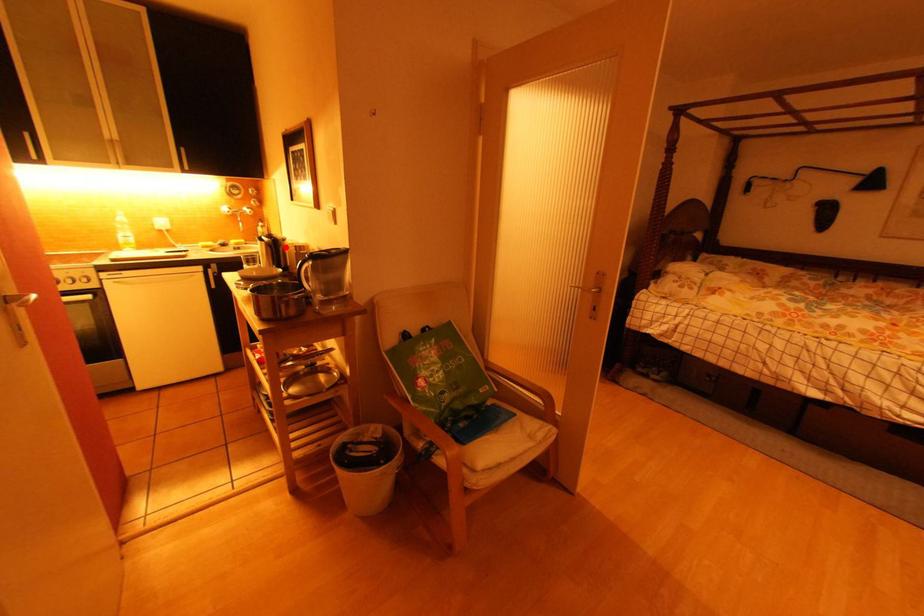
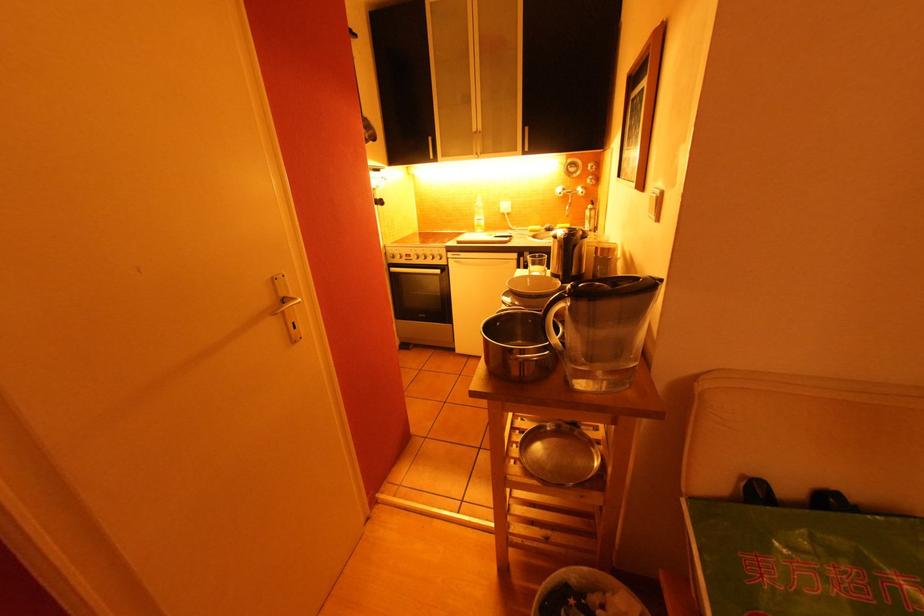
Where in the second image is the point corresponding to the highlighted location from the first image?

(579, 246)